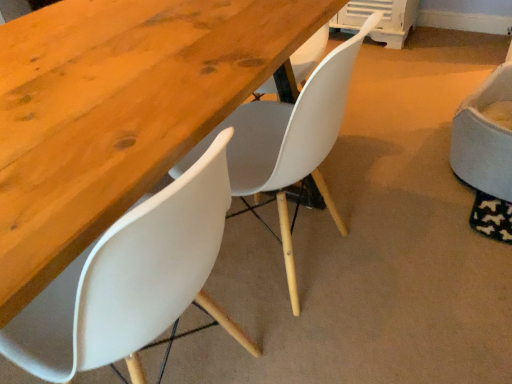
Question: Is white fabric chair at right, which appears as the 1th chair when viewed from the right, positioned behind white matte chair at center, which ranks as the second chair in right-to-left order?

Choices:
 (A) no
 (B) yes

Answer: (B)

Question: Does white fabric chair at right, which appears as the 1th chair when viewed from the right, have a greater height compared to white matte chair at center, the second chair viewed from the left?

Choices:
 (A) no
 (B) yes

Answer: (A)

Question: Is white fabric chair at right, which appears as the 1th chair when viewed from the right, turned away from white matte chair at center, which ranks as the second chair in right-to-left order?

Choices:
 (A) no
 (B) yes

Answer: (A)

Question: Is white fabric chair at right, which appears as the 1th chair when viewed from the right, far away from white matte chair at center, which ranks as the second chair in right-to-left order?

Choices:
 (A) no
 (B) yes

Answer: (A)

Question: From the image's perspective, does white fabric chair at right, which appears as the 1th chair when viewed from the right, appear higher than white matte chair at center, which ranks as the second chair in right-to-left order?

Choices:
 (A) yes
 (B) no

Answer: (A)

Question: From a real-world perspective, is white fabric chair at right, which appears as the 1th chair when viewed from the right, physically located above or below white matte chair at center, the second chair viewed from the left?

Choices:
 (A) below
 (B) above

Answer: (A)

Question: Is white fabric chair at right, which is the 3th chair from left to right, wider or thinner than white matte chair at center, which ranks as the second chair in right-to-left order?

Choices:
 (A) thin
 (B) wide

Answer: (A)

Question: Is point (497, 150) positioned closer to the camera than point (300, 144)?

Choices:
 (A) farther
 (B) closer

Answer: (A)

Question: In terms of height, does white fabric chair at right, which is the 3th chair from left to right, look taller or shorter compared to white matte chair at center, the second chair viewed from the left?

Choices:
 (A) short
 (B) tall

Answer: (A)

Question: From a real-world perspective, relative to wooden table at center, is white fabric chair at right, which appears as the 1th chair when viewed from the right, vertically above or below?

Choices:
 (A) above
 (B) below

Answer: (B)

Question: Is white fabric chair at right, which is the 3th chair from left to right, spatially inside wooden table at center, or outside of it?

Choices:
 (A) inside
 (B) outside

Answer: (B)

Question: From the image's perspective, is white fabric chair at right, which is the 3th chair from left to right, located above or below wooden table at center?

Choices:
 (A) above
 (B) below

Answer: (A)

Question: Visually, is white fabric chair at right, which appears as the 1th chair when viewed from the right, positioned to the left or to the right of wooden table at center?

Choices:
 (A) right
 (B) left

Answer: (A)

Question: Considering their positions, is wooden table at center located in front of or behind white plastic chair at lower left, the 3th chair viewed from the right?

Choices:
 (A) behind
 (B) front

Answer: (A)

Question: From a real-world perspective, relative to white plastic chair at lower left, the 3th chair viewed from the right, is wooden table at center vertically above or below?

Choices:
 (A) above
 (B) below

Answer: (B)